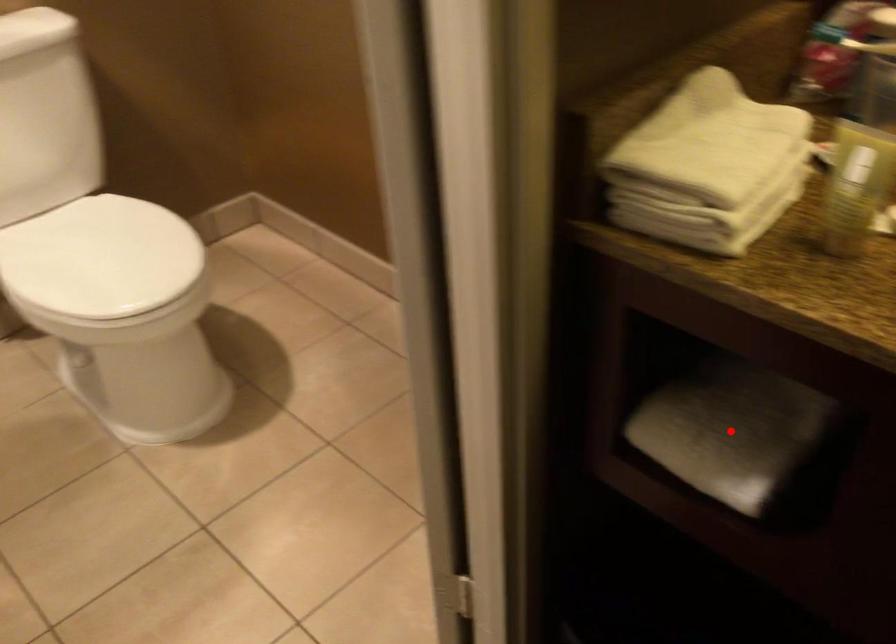
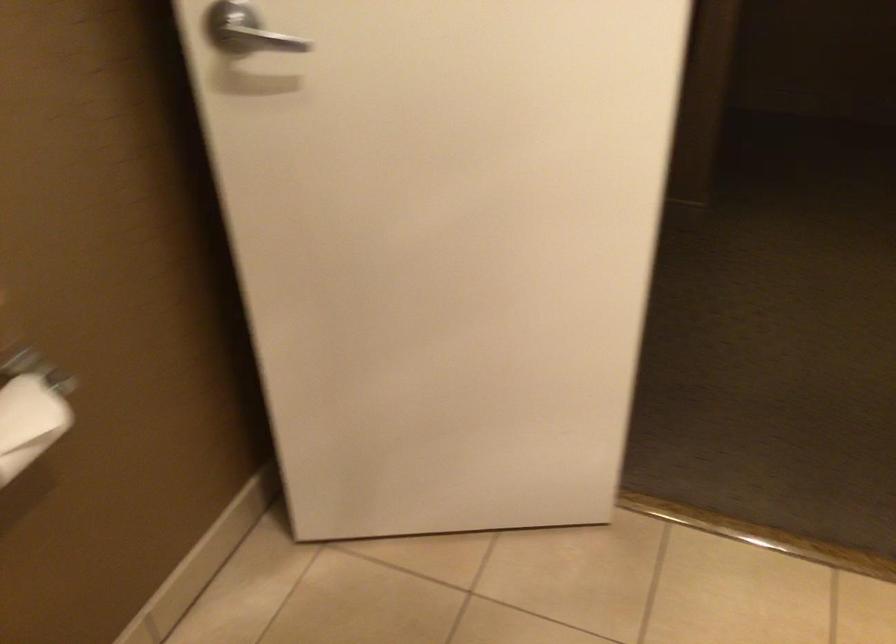
Question: I am providing you with two images of the same scene from different viewpoints. A red point is marked on the first image. Can you still see the location of the red point in image 2?

Choices:
 (A) Yes
 (B) No

Answer: (B)